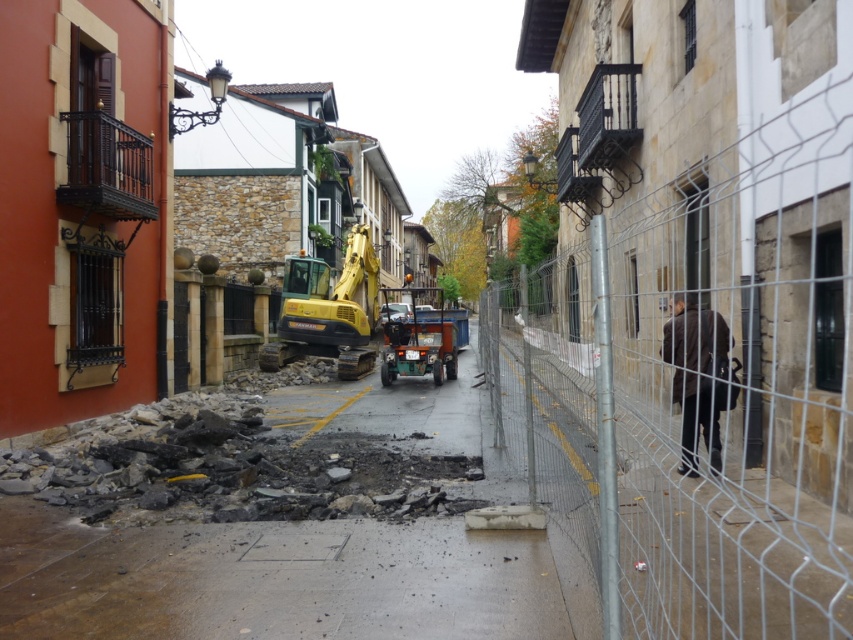
Who is positioned more to the right, broken asphalt at center or dark gray rubble at center?

broken asphalt at center

Which is in front, point (28, 538) or point (421, 508)?

Positioned in front is point (28, 538).

Which is in front, point (270, 397) or point (248, 477)?

Point (248, 477) is in front.

Locate an element on the screen. The height and width of the screenshot is (640, 853). broken asphalt at center is located at coordinates (286, 579).

Between yellow-green metal excavator at center and green rubber utility vehicle at center, which one has less height?

With less height is yellow-green metal excavator at center.

Which is in front, point (357, 237) or point (419, 352)?

Point (419, 352) is in front.

I want to click on yellow-green metal excavator at center, so click(329, 308).

Is dark gray rubble at center wider than green rubber utility vehicle at center?

No.

Between dark gray rubble at center and green rubber utility vehicle at center, which one is positioned lower?

dark gray rubble at center is lower down.

Does point (149, 480) come in front of point (392, 372)?

That is True.

Find the location of a particular element. dark gray rubble at center is located at coordinates (238, 468).